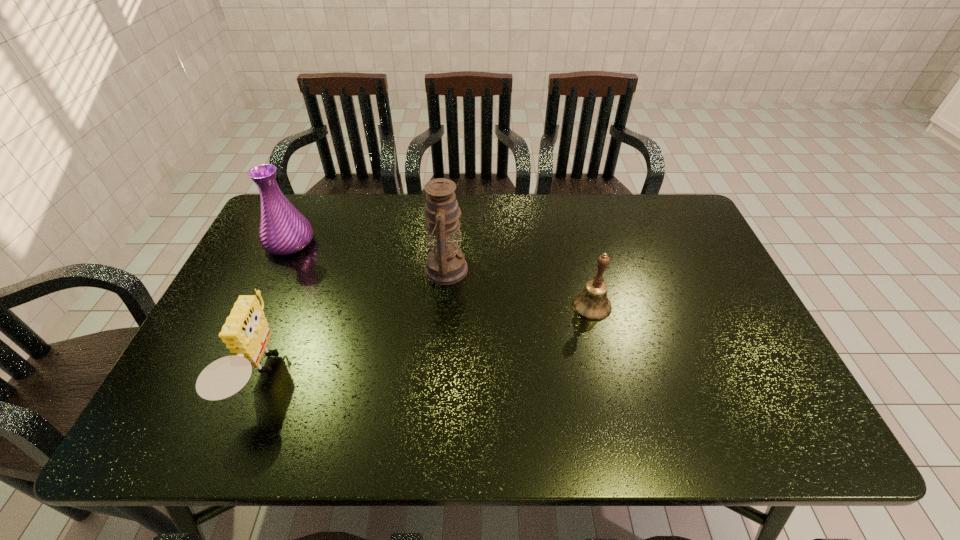
I want to click on vase positioned at the left edge, so click(x=283, y=230).

The height and width of the screenshot is (540, 960). Find the location of `sponge that is at the left edge`. sponge that is at the left edge is located at coordinates (245, 333).

Image resolution: width=960 pixels, height=540 pixels. In order to click on object that is positioned at the far left corner in this screenshot , I will do `click(283, 230)`.

This screenshot has height=540, width=960. Find the location of `object that is positioned at the near left corner`. object that is positioned at the near left corner is located at coordinates (245, 333).

At what (x,y) coordinates should I click in order to perform the action: click on free point at the far edge. Please return your answer as a coordinate pair (x, y). Looking at the image, I should click on (363, 212).

This screenshot has height=540, width=960. What are the coordinates of `vacant area at the near edge` in the screenshot? It's located at (705, 412).

Find the location of `vacant space at the left edge of the desktop`. vacant space at the left edge of the desktop is located at coordinates (290, 286).

The image size is (960, 540). In the image, there is a desktop. What are the coordinates of `free space at the right edge` in the screenshot? It's located at (740, 356).

Locate an element on the screen. The image size is (960, 540). vacant area that lies between the oil lamp and the third shortest object is located at coordinates (367, 256).

Identify the location of unoccupied position between the sponge and the second tallest object. (275, 309).